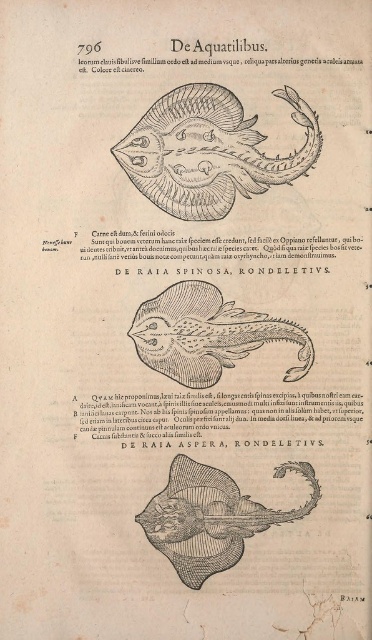
Question: Which point appears closest to the camera in this image?

Choices:
 (A) (238, 170)
 (B) (213, 541)

Answer: (B)

Question: Considering the relative positions of gray etched ray at lower center and black paper at lower center in the image provided, where is gray etched ray at lower center located with respect to black paper at lower center?

Choices:
 (A) below
 (B) above

Answer: (A)

Question: Is brown textured ray at center below black paper at lower right?

Choices:
 (A) yes
 (B) no

Answer: (B)

Question: Which object is the closest to the black paper at lower center?

Choices:
 (A) black paper at lower right
 (B) gray etched ray at lower center
 (C) brown textured ray at center
 (D) grayish matte ray at center

Answer: (D)

Question: Which of the following is the farthest from the observer?

Choices:
 (A) (252, 180)
 (B) (178, 288)
 (C) (289, 468)

Answer: (B)

Question: From the image, what is the correct spatial relationship of brown textured ray at center in relation to black paper at lower center?

Choices:
 (A) left
 (B) right

Answer: (A)